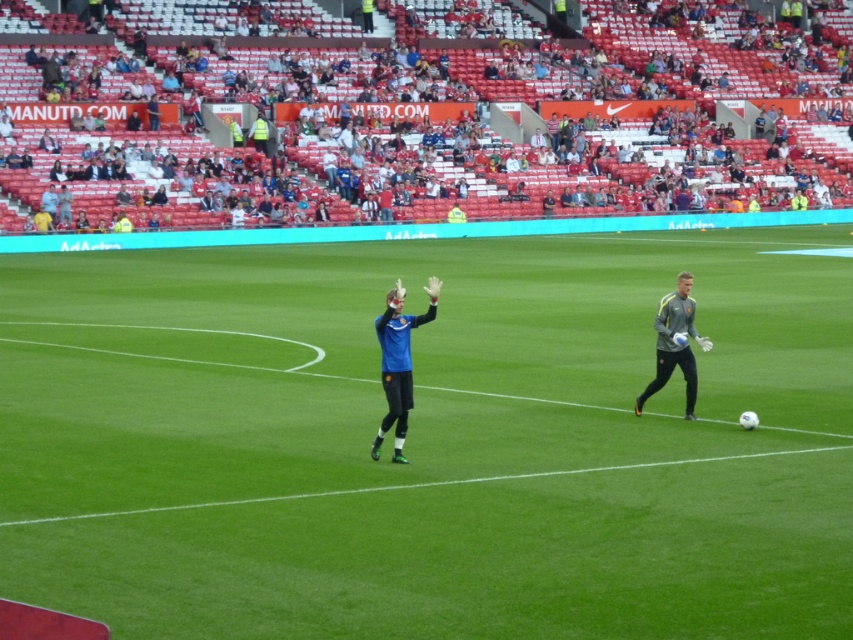
You are a soccer coach observing the training session. You notice the green grass field at center and the blue matte jersey at center. Which object is taller?

The green grass field at center is taller than the blue matte jersey at center.

You are a photographer trying to capture a clear shot of both the blue jersey at center and the blue matte jersey at center during the soccer training. Since they are both in the same area, which jersey should you focus on first to ensure it fits entirely within your camera frame?

The blue jersey at center has a larger size compared to blue matte jersey at center, so you should focus on capturing the blue jersey at center first to ensure it fits entirely within your camera frame before adjusting for the smaller one.